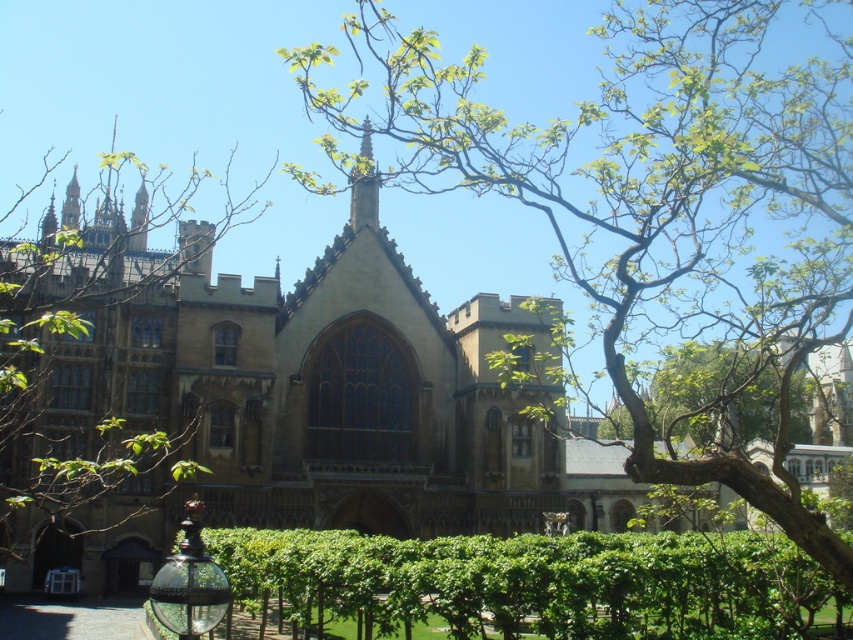
Can you confirm if green leafy tree at center is bigger than green leafy hedge at center?

Yes, green leafy tree at center is bigger than green leafy hedge at center.

From the picture: Who is positioned more to the right, green leafy tree at center or green leafy hedge at center?

green leafy tree at center

Describe the element at coordinates (657, 202) in the screenshot. I see `green leafy tree at center` at that location.

At what (x,y) coordinates should I click in order to perform the action: click on green leafy tree at center. Please return your answer as a coordinate pair (x, y). This screenshot has width=853, height=640. Looking at the image, I should click on (657, 202).